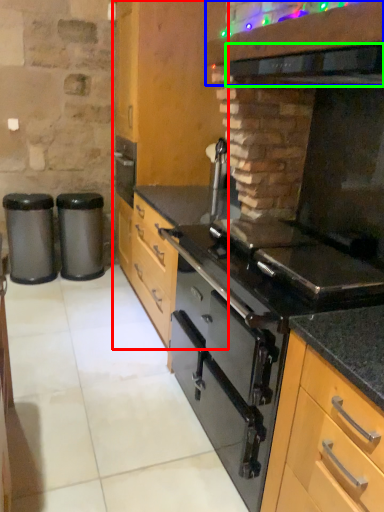
Question: Which object is positioned closest to cabinetry (highlighted by a red box)? Select from vent (highlighted by a blue box) and exhaust hood (highlighted by a green box).

Choices:
 (A) vent
 (B) exhaust hood

Answer: (A)